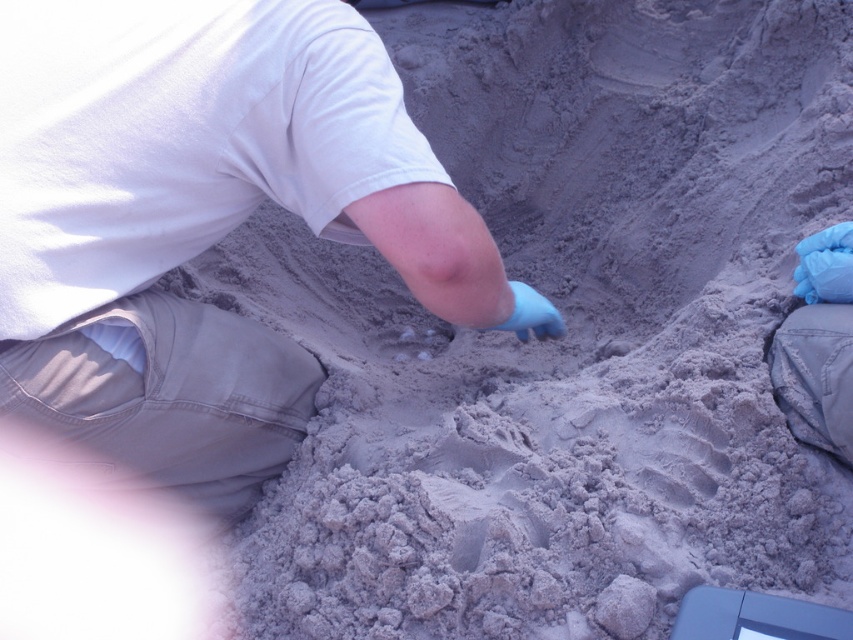
Can you confirm if white matte shirt at center is smaller than blue denim pants at lower right?

No.

Is point (199, 428) more distant than point (810, 436)?

That is False.

Where is `white matte shirt at center`? The height and width of the screenshot is (640, 853). white matte shirt at center is located at coordinates pyautogui.click(x=202, y=220).